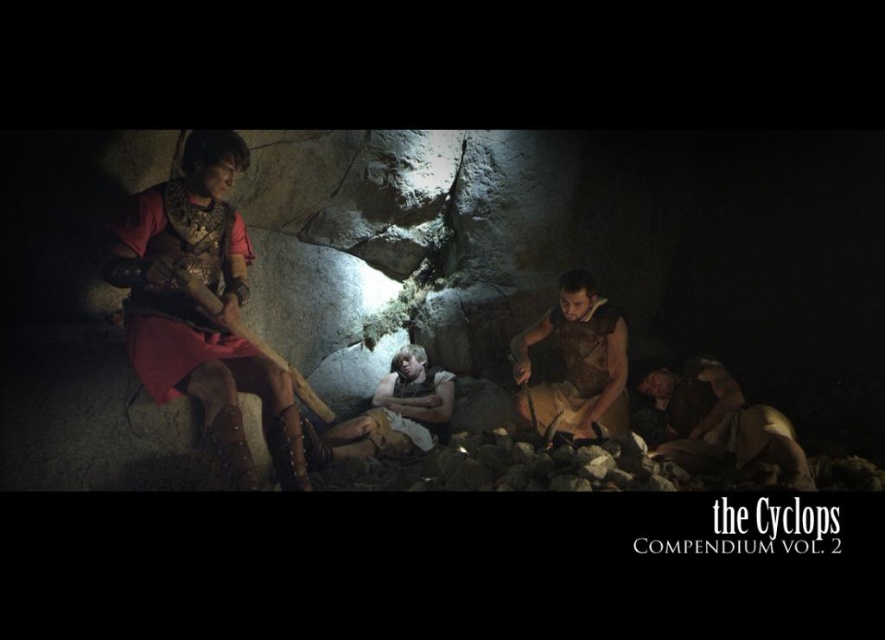
Question: From the image, what is the correct spatial relationship of matte red tunic at left in relation to brown leather armor at center?

Choices:
 (A) above
 (B) below

Answer: (A)

Question: Based on their relative distances, which object is nearer to the light brown leather armor at center?

Choices:
 (A) matte red tunic at left
 (B) brown leather armor at center

Answer: (B)

Question: Is brown leather armor at center above light brown leather armor at center?

Choices:
 (A) yes
 (B) no

Answer: (A)

Question: Which of these objects is positioned farthest from the matte red tunic at left?

Choices:
 (A) brown leather armor at center
 (B) light brown leather armor at center

Answer: (A)

Question: Which point is farther from the camera taking this photo?

Choices:
 (A) (610, 387)
 (B) (150, 273)
 (C) (687, 464)
 (D) (390, 392)

Answer: (D)

Question: Is brown leather armor at lower right to the right of brown leather armor at center from the viewer's perspective?

Choices:
 (A) yes
 (B) no

Answer: (A)